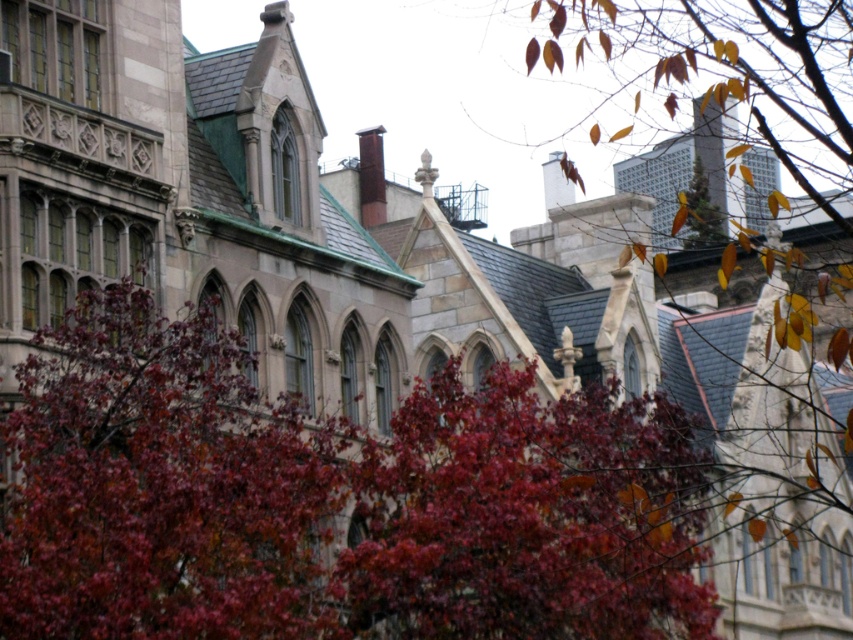
You are a photographer planning to capture a closeup shot of the shiny red leaves at center and autumn leaves at upper right. Based on their positions, which leaves should you focus on first to ensure both are in sharp focus?

The shiny red leaves at center is much taller than autumn leaves at upper right, so you should focus on the shiny red leaves at center first to ensure both are in sharp focus.